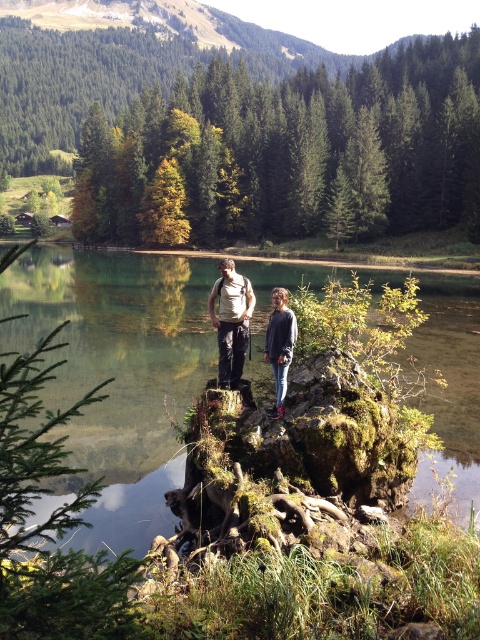
You are a photographer trying to capture a wide shot of the green mossy rock at center and the khaki fabric pants at center. Based on their sizes, which object would appear larger in the photo?

The green mossy rock at center would appear larger in the photo since it is wider than the khaki fabric pants at center.

You are a photographer trying to capture a photo of the green mossy rock at center and the khaki fabric pants at center. Since you want to ensure both are in focus, you need to know which one is taller. Can you tell me which object is taller?

The green mossy rock at center is taller than the khaki fabric pants at center according to the description.

You are a photographer trying to capture the two people in the scene. You want to ensure that the khaki fabric pants at center and the gray sweater at center are both visible in your shot. Based on their positions, which clothing item should you focus on first to frame them properly?

The khaki fabric pants at center should be focused on first since they are to the left of the gray sweater at center, so adjusting the frame to include the left side ensures both are captured.